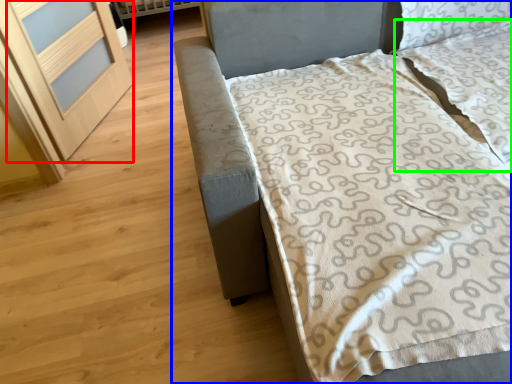
Question: Based on their relative distances, which object is farther from screen door (highlighted by a red box)? Choose from bed (highlighted by a blue box) and pillow (highlighted by a green box).

Choices:
 (A) bed
 (B) pillow

Answer: (B)